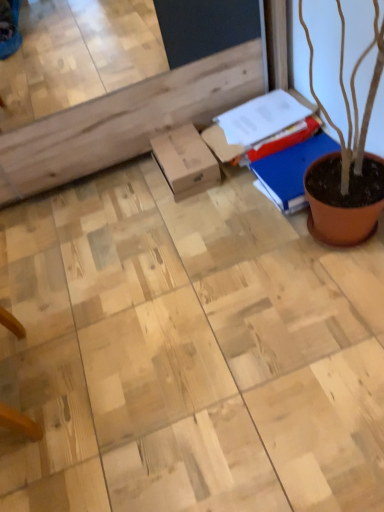
Question: Should I look upward or downward to see blue matte book at upper right?

Choices:
 (A) up
 (B) down

Answer: (A)

Question: Considering the relative sizes of cardboard box at center and blue matte notebook at right in the image provided, is cardboard box at center bigger than blue matte notebook at right?

Choices:
 (A) no
 (B) yes

Answer: (A)

Question: Is cardboard box at center at the right side of blue matte notebook at right?

Choices:
 (A) no
 (B) yes

Answer: (A)

Question: From the image's perspective, is cardboard box at center under blue matte notebook at right?

Choices:
 (A) no
 (B) yes

Answer: (A)

Question: Is cardboard box at center positioned in front of blue matte notebook at right?

Choices:
 (A) no
 (B) yes

Answer: (A)

Question: Is cardboard box at center located outside blue matte notebook at right?

Choices:
 (A) no
 (B) yes

Answer: (B)

Question: Is cardboard box at center shorter than blue matte notebook at right?

Choices:
 (A) yes
 (B) no

Answer: (B)

Question: From a real-world perspective, is cardboard box at center positioned under blue matte book at upper right based on gravity?

Choices:
 (A) yes
 (B) no

Answer: (A)

Question: Is cardboard box at center facing towards blue matte book at upper right?

Choices:
 (A) no
 (B) yes

Answer: (A)

Question: From the image's perspective, would you say cardboard box at center is shown under blue matte book at upper right?

Choices:
 (A) no
 (B) yes

Answer: (B)

Question: Is the depth of cardboard box at center less than that of blue matte book at upper right?

Choices:
 (A) no
 (B) yes

Answer: (A)

Question: Does cardboard box at center have a lesser height compared to blue matte book at upper right?

Choices:
 (A) yes
 (B) no

Answer: (A)

Question: Considering the relative sizes of cardboard box at center and blue matte book at upper right in the image provided, is cardboard box at center bigger than blue matte book at upper right?

Choices:
 (A) yes
 (B) no

Answer: (B)

Question: Is blue matte book at upper right wider than cardboard box at center?

Choices:
 (A) no
 (B) yes

Answer: (B)